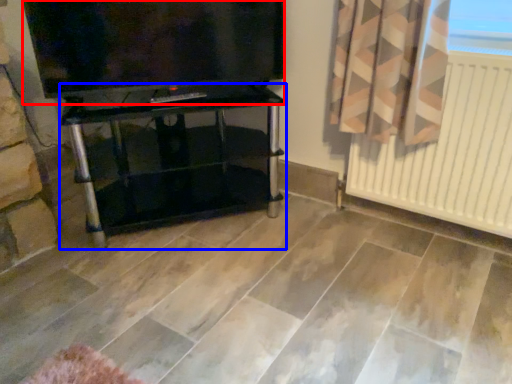
Question: Which object appears farthest to the camera in this image, television (highlighted by a red box) or furniture (highlighted by a blue box)?

Choices:
 (A) television
 (B) furniture

Answer: (B)